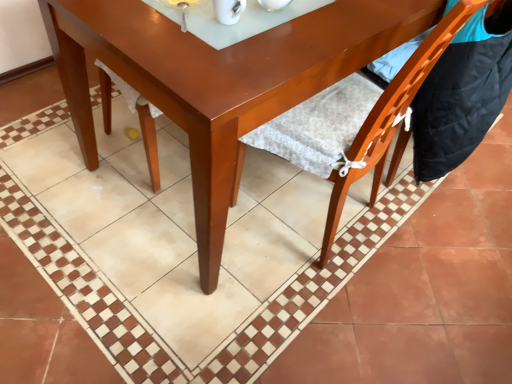
Question: Can you confirm if wooden chair at lower right, positioned as the second chair in right-to-left order, is shorter than orange wood chair at lower right, the second chair positioned from the left?

Choices:
 (A) no
 (B) yes

Answer: (A)

Question: Does wooden chair at lower right, positioned as the second chair in right-to-left order, appear on the left side of orange wood chair at lower right, which is the first chair from right to left?

Choices:
 (A) yes
 (B) no

Answer: (A)

Question: Is wooden chair at lower right, arranged as the first chair when viewed from the left, positioned in front of orange wood chair at lower right, which is the first chair from right to left?

Choices:
 (A) no
 (B) yes

Answer: (B)

Question: Is wooden chair at lower right, positioned as the second chair in right-to-left order, behind orange wood chair at lower right, which is the first chair from right to left?

Choices:
 (A) yes
 (B) no

Answer: (B)

Question: From the image's perspective, does wooden chair at lower right, arranged as the first chair when viewed from the left, appear lower than orange wood chair at lower right, the second chair positioned from the left?

Choices:
 (A) no
 (B) yes

Answer: (B)

Question: From a real-world perspective, is wooden chair at lower right, arranged as the first chair when viewed from the left, physically below orange wood chair at lower right, the second chair positioned from the left?

Choices:
 (A) yes
 (B) no

Answer: (B)

Question: Does glossy wood table at center have a larger size compared to wooden chair at lower right, arranged as the first chair when viewed from the left?

Choices:
 (A) yes
 (B) no

Answer: (A)

Question: Is glossy wood table at center looking in the opposite direction of wooden chair at lower right, positioned as the second chair in right-to-left order?

Choices:
 (A) yes
 (B) no

Answer: (A)

Question: Is glossy wood table at center at the right side of wooden chair at lower right, arranged as the first chair when viewed from the left?

Choices:
 (A) no
 (B) yes

Answer: (A)

Question: Does glossy wood table at center have a lesser width compared to wooden chair at lower right, positioned as the second chair in right-to-left order?

Choices:
 (A) yes
 (B) no

Answer: (B)

Question: Is glossy wood table at center wider than wooden chair at lower right, positioned as the second chair in right-to-left order?

Choices:
 (A) yes
 (B) no

Answer: (A)

Question: From the image's perspective, is glossy wood table at center located beneath wooden chair at lower right, arranged as the first chair when viewed from the left?

Choices:
 (A) yes
 (B) no

Answer: (B)

Question: From a real-world perspective, is glossy wood table at center on top of orange wood chair at lower right, which is the first chair from right to left?

Choices:
 (A) yes
 (B) no

Answer: (B)